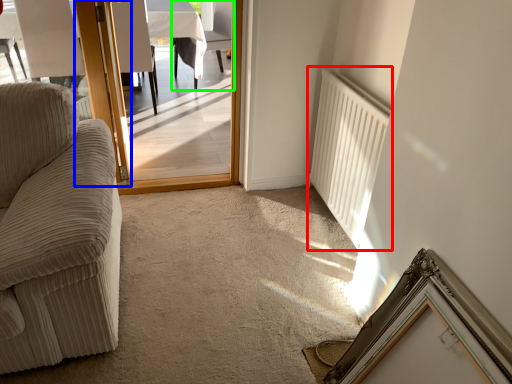
Question: Considering the real-world distances, which object is closest to radiator (highlighted by a red box)? door (highlighted by a blue box) or chair (highlighted by a green box).

Choices:
 (A) door
 (B) chair

Answer: (A)